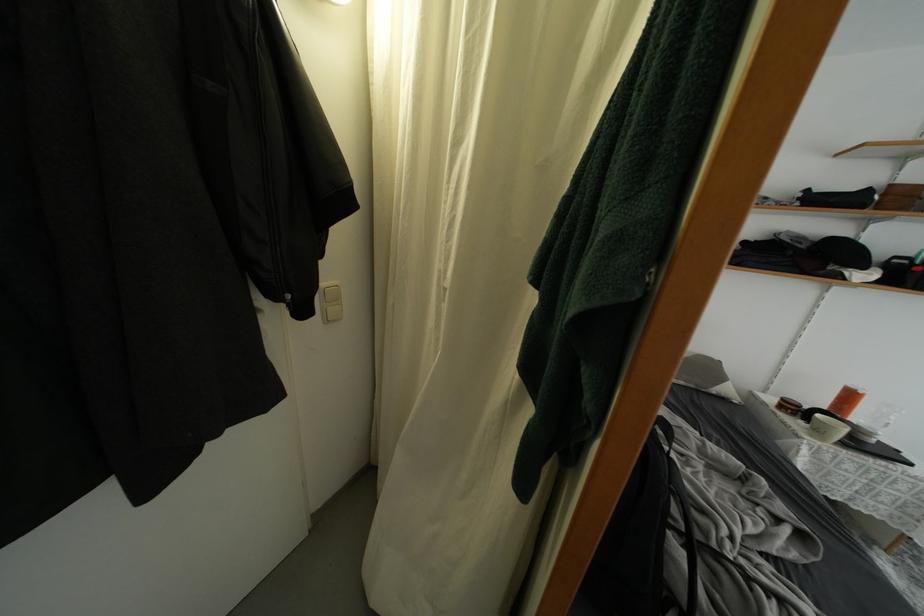
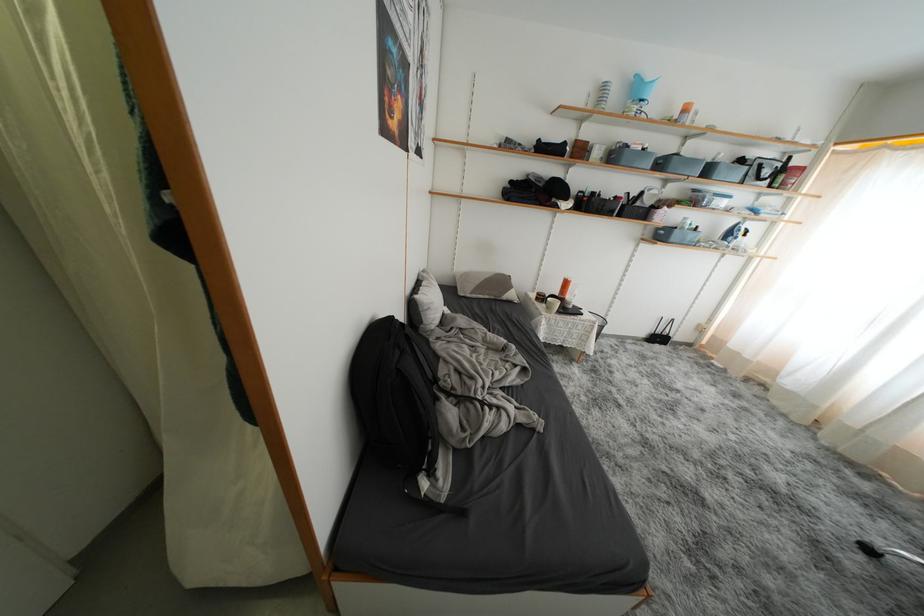
Find the pixel in the second image that matches point (856, 400) in the first image.

(572, 286)